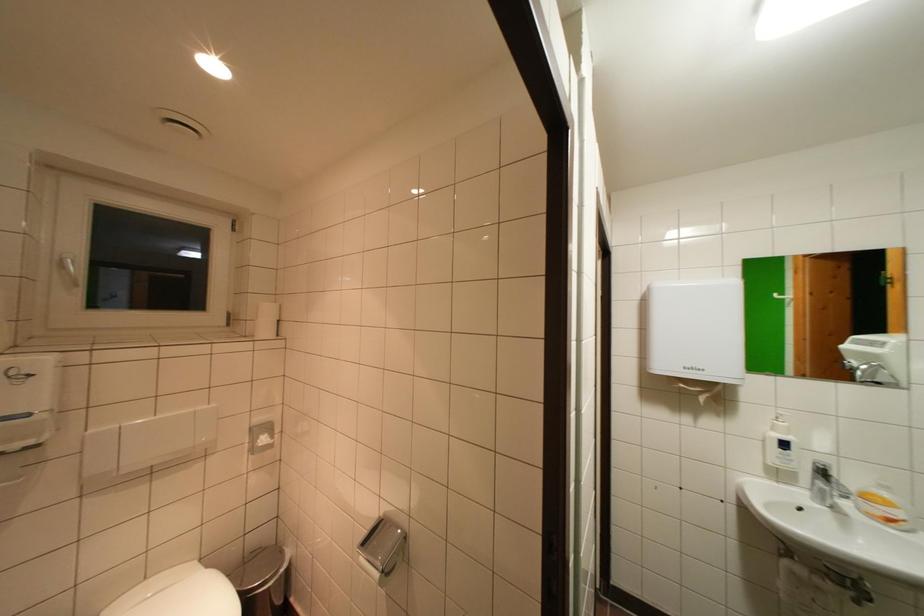
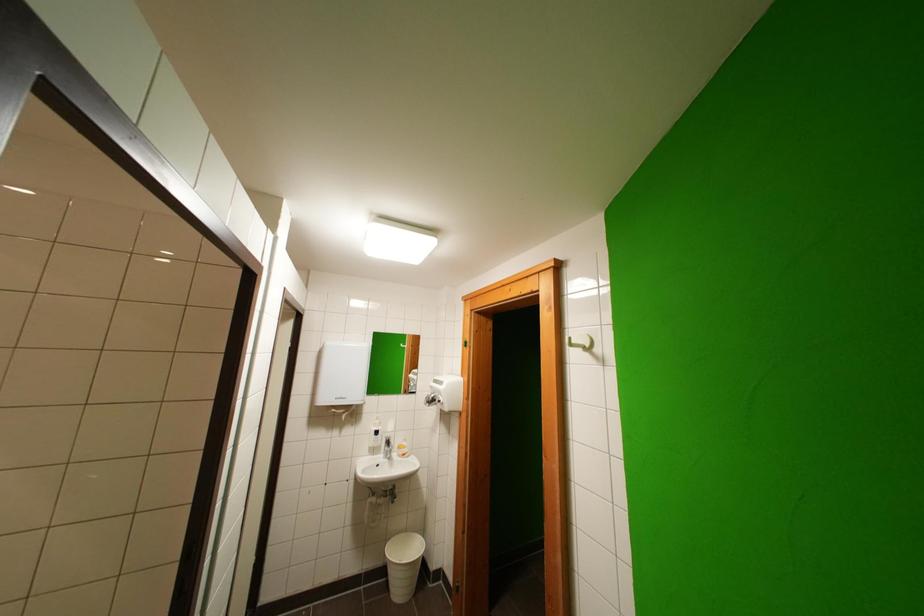
Find the pixel in the second image that matches point 792,448 in the first image.

(383, 436)